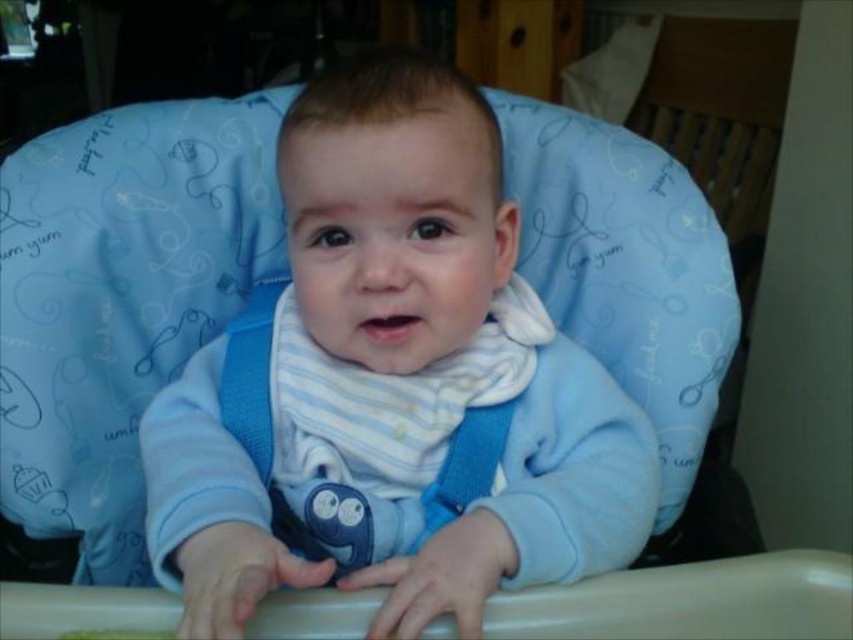
You are a parent trying to choose between two bibs for your baby. The baby is currently wearing both a blue soft bib at center and a white striped bib at center. Which bib covers more of the baby from top to bottom?

The blue soft bib at center is much taller than the white striped bib at center, so it covers more of the baby from top to bottom.

You are a parent trying to choose between the blue soft bib at center and the white striped bib at center for your baby. Which one would you pick if you want the larger one?

The blue soft bib at center is bigger than the white striped bib at center, so you should choose the blue soft bib at center.